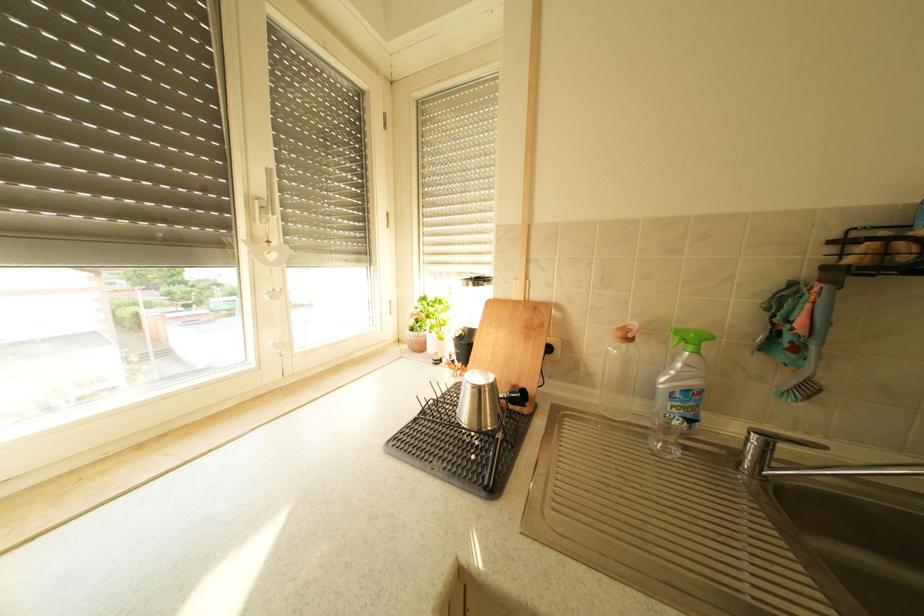
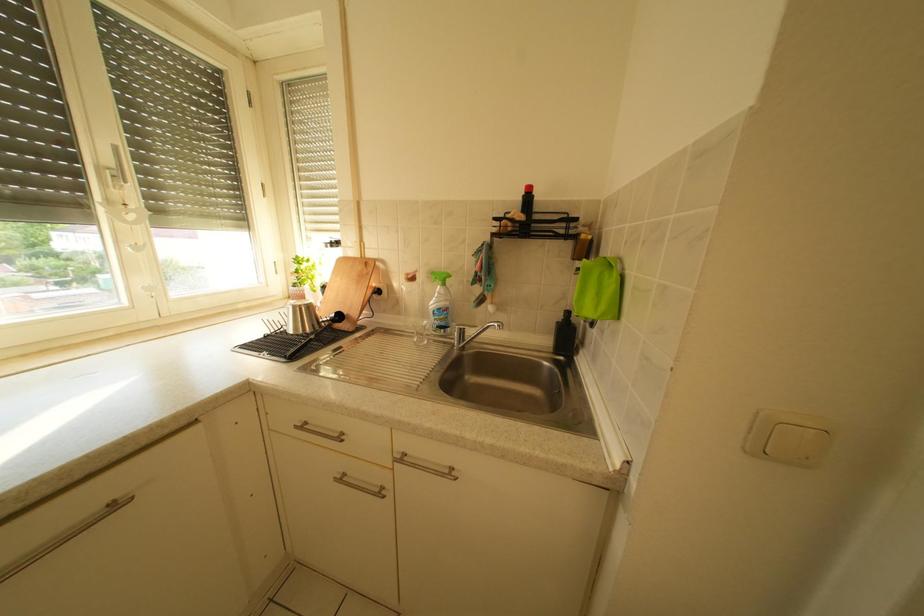
Question: The camera is either moving clockwise (left) or counter-clockwise (right) around the object. The first image is from the beginning of the video and the second image is from the end. Is the camera moving left or right when shooting the video?

Choices:
 (A) Left
 (B) Right

Answer: (A)